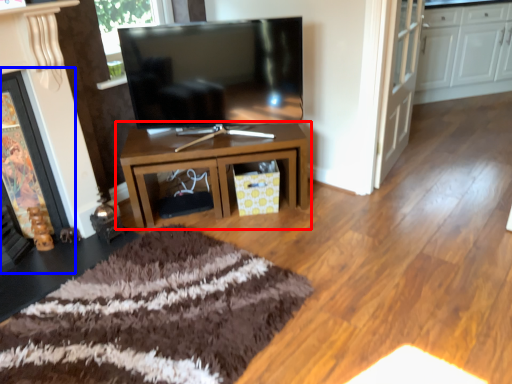
Question: Among these objects, which one is nearest to the camera, table (highlighted by a red box) or fireplace (highlighted by a blue box)?

Choices:
 (A) table
 (B) fireplace

Answer: (B)